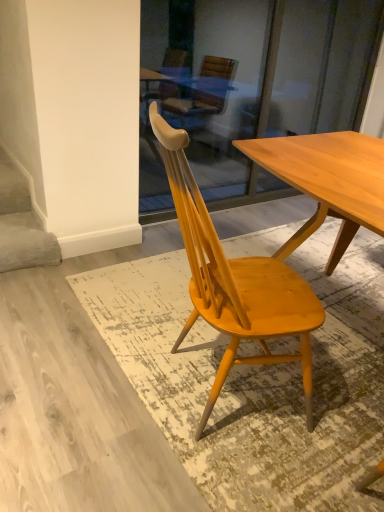
The width and height of the screenshot is (384, 512). What do you see at coordinates (21, 224) in the screenshot? I see `white matte stairwell at lower left` at bounding box center [21, 224].

Measure the distance between white matte stairwell at lower left and camera.

6.75 feet.

Find the location of `white matte stairwell at lower left`. white matte stairwell at lower left is located at coordinates (21, 224).

What is the approximate height of light brown wood chair at center?

The height of light brown wood chair at center is 38.46 inches.

Identify the location of light brown wood chair at center. (235, 281).

What do you see at coordinates (235, 281) in the screenshot?
I see `light brown wood chair at center` at bounding box center [235, 281].

Measure the distance between point (294, 285) and camera.

Point (294, 285) and camera are 4.73 feet apart.

Locate an element on the screen. white matte stairwell at lower left is located at coordinates (21, 224).

Considering the relative positions of white matte stairwell at lower left and light brown wood chair at center in the image provided, is white matte stairwell at lower left to the left of light brown wood chair at center from the viewer's perspective?

Yes, white matte stairwell at lower left is to the left of light brown wood chair at center.

Considering the relative positions of white matte stairwell at lower left and light brown wood chair at center in the image provided, is white matte stairwell at lower left in front of light brown wood chair at center?

No.

Which is less distant, (33, 220) or (204, 207)?

Point (33, 220) is positioned farther from the camera compared to point (204, 207).

From the image's perspective, which is below, white matte stairwell at lower left or light brown wood chair at center?

light brown wood chair at center.

From a real-world perspective, which object stands above the other?

light brown wood chair at center is physically above.

Is white matte stairwell at lower left wider or thinner than light brown wood chair at center?

white matte stairwell at lower left is thinner than light brown wood chair at center.

Who is taller, white matte stairwell at lower left or light brown wood chair at center?

light brown wood chair at center.

Considering the sizes of objects white matte stairwell at lower left and light brown wood chair at center in the image provided, who is smaller, white matte stairwell at lower left or light brown wood chair at center?

white matte stairwell at lower left.

Is white matte stairwell at lower left not inside light brown wood chair at center?

Yes, white matte stairwell at lower left is not within light brown wood chair at center.

Consider the image. Is there a large distance between white matte stairwell at lower left and light brown wood chair at center?

Yes.

Is white matte stairwell at lower left aimed at light brown wood chair at center?

No, white matte stairwell at lower left is not facing towards light brown wood chair at center.

Measure the distance from white matte stairwell at lower left to light brown wood chair at center.

white matte stairwell at lower left and light brown wood chair at center are 3.91 feet apart.

This screenshot has height=512, width=384. Find the location of `stairwell on the left of light brown wood chair at center`. stairwell on the left of light brown wood chair at center is located at coordinates (21, 224).

Can you confirm if light brown wood chair at center is positioned to the right of white matte stairwell at lower left?

Indeed, light brown wood chair at center is positioned on the right side of white matte stairwell at lower left.

Is light brown wood chair at center behind white matte stairwell at lower left?

No.

Considering the points (254, 362) and (9, 187), which point is in front, point (254, 362) or point (9, 187)?

The point (254, 362) is in front.

From the image's perspective, is light brown wood chair at center under white matte stairwell at lower left?

Indeed, from the image's perspective, light brown wood chair at center is shown beneath white matte stairwell at lower left.

From a real-world perspective, which is physically below, light brown wood chair at center or white matte stairwell at lower left?

white matte stairwell at lower left, from a real-world perspective.

Is light brown wood chair at center thinner than white matte stairwell at lower left?

No, light brown wood chair at center is not thinner than white matte stairwell at lower left.

Does light brown wood chair at center have a lesser height compared to white matte stairwell at lower left?

No, light brown wood chair at center is not shorter than white matte stairwell at lower left.

Between light brown wood chair at center and white matte stairwell at lower left, which one has larger size?

light brown wood chair at center is bigger.

Is light brown wood chair at center positioned beyond the bounds of white matte stairwell at lower left?

Yes, light brown wood chair at center is not within white matte stairwell at lower left.

Are light brown wood chair at center and white matte stairwell at lower left far apart?

Indeed, light brown wood chair at center is not near white matte stairwell at lower left.

Looking at this image, is light brown wood chair at center looking in the opposite direction of white matte stairwell at lower left?

No, white matte stairwell at lower left is not at the back of light brown wood chair at center.

At what (x,y) coordinates should I click in order to perform the action: click on stairwell behind the light brown wood chair at center. Please return your answer as a coordinate pair (x, y). The height and width of the screenshot is (512, 384). Looking at the image, I should click on (21, 224).

You are a GUI agent. You are given a task and a screenshot of the screen. Output one action in this format:
    pyautogui.click(x=<x>, y=<y>)
    Task: Click on the stairwell directly beneath the light brown wood chair at center (from a real-world perspective)
    
    Given the screenshot: What is the action you would take?
    pyautogui.click(x=21, y=224)

Identify the location of stairwell on the left of light brown wood chair at center. (21, 224).